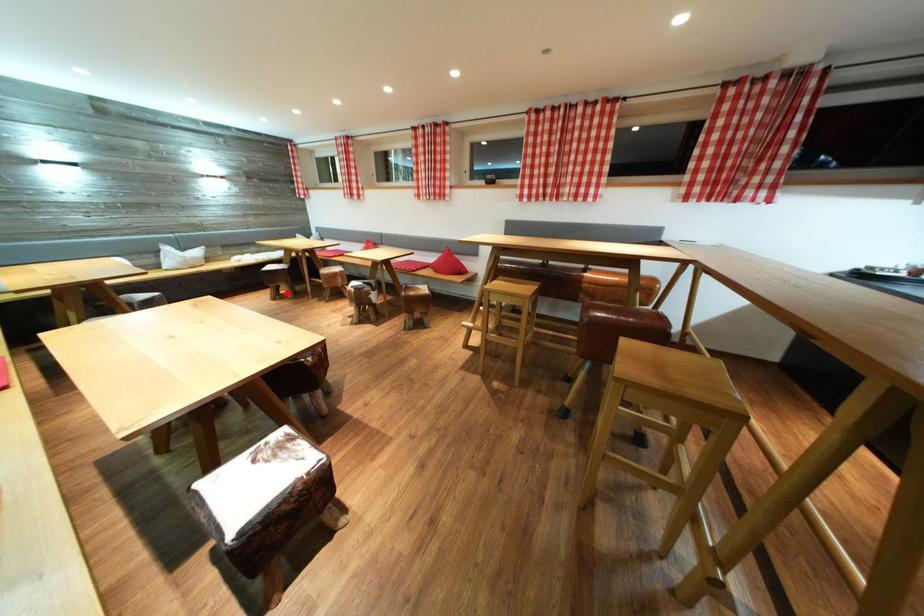
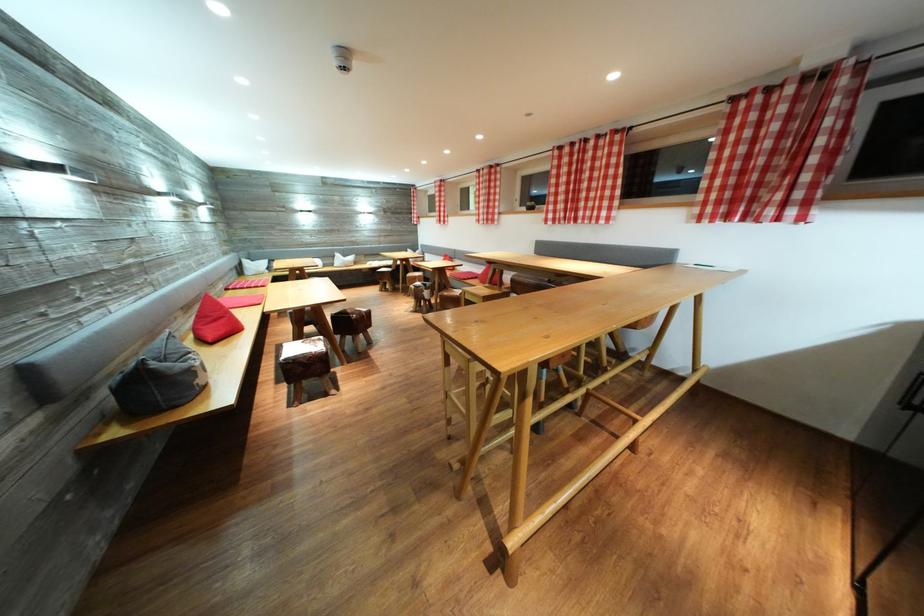
Question: I am providing you with two images of the same scene from different viewpoints. A red point is shown in image1. For the corresponding object point in image2, is it positioned nearer or farther from the camera?

Choices:
 (A) Nearer
 (B) Farther

Answer: (B)